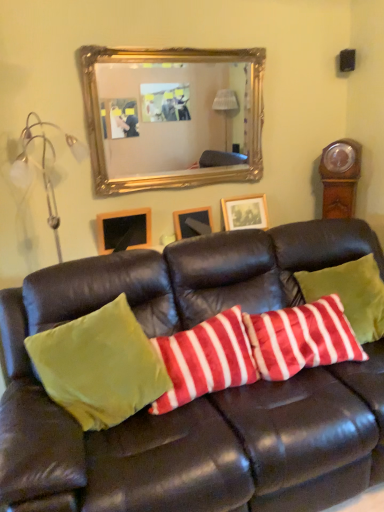
This screenshot has height=512, width=384. Identify the location of green velvet pillow at center, marked as the third pillow in a right-to-left arrangement. (99, 366).

This screenshot has width=384, height=512. Find the location of `velvet green couch at center`. velvet green couch at center is located at coordinates (197, 399).

This screenshot has height=512, width=384. I want to click on matte white picture frame at center, acting as the 3th picture frame starting from the left, so click(x=245, y=212).

Could you tell me if metallic silver lamp at left is turned towards velvet green couch at center?

No.

From the image's perspective, is metallic silver lamp at left positioned above or below velvet green couch at center?

From the image's perspective, metallic silver lamp at left appears above velvet green couch at center.

Is point (24, 168) behind point (237, 296)?

Yes, it is behind point (237, 296).

Considering the relative positions of metallic silver lamp at left and velvet green couch at center in the image provided, is metallic silver lamp at left in front of velvet green couch at center?

No.

Is metallic silver lamp at left next to velvety red and white striped pillow at center, positioned as the 2th pillow in left-to-right order?

No, metallic silver lamp at left is not beside velvety red and white striped pillow at center, positioned as the 2th pillow in left-to-right order.

From a real-world perspective, relative to velvety red and white striped pillow at center, positioned as the 2th pillow in left-to-right order, is metallic silver lamp at left vertically above or below?

In terms of real-world spatial position, metallic silver lamp at left is above velvety red and white striped pillow at center, positioned as the 2th pillow in left-to-right order.

This screenshot has width=384, height=512. I want to click on the 3rd pillow positioned below the metallic silver lamp at left (from a real-world perspective), so click(205, 360).

Is metallic silver lamp at left aimed at velvety red and white striped pillow at center, positioned as the 2th pillow in left-to-right order?

No, metallic silver lamp at left does not turn towards velvety red and white striped pillow at center, positioned as the 2th pillow in left-to-right order.

Considering their positions, is velvet green couch at center located in front of or behind metallic silver lamp at left?

Visually, velvet green couch at center is located in front of metallic silver lamp at left.

Considering the relative sizes of velvet green couch at center and metallic silver lamp at left in the image provided, is velvet green couch at center smaller than metallic silver lamp at left?

Actually, velvet green couch at center might be larger than metallic silver lamp at left.

Is velvet green couch at center positioned with its back to metallic silver lamp at left?

No, velvet green couch at center is not facing away from metallic silver lamp at left.

Would you say velvet green couch at center is a long distance from metallic silver lamp at left?

Yes, velvet green couch at center is far from metallic silver lamp at left.

Are velvet green couch at center and wooden picture frame at upper left, the 1th picture frame from the left, far apart?

velvet green couch at center is actually quite close to wooden picture frame at upper left, the 1th picture frame from the left.

Locate an element on the screen. The width and height of the screenshot is (384, 512). the 1st picture frame above when counting from the velvet green couch at center (from the image's perspective) is located at coordinates (124, 229).

Does velvet green couch at center have a lesser height compared to wooden picture frame at upper left, the 1th picture frame from the left?

Incorrect, the height of velvet green couch at center does not fall short of that of wooden picture frame at upper left, the 1th picture frame from the left.

From a real-world perspective, is velvet green couch at center beneath wooden picture frame at upper left, which is the third picture frame in right-to-left order?

Yes, from a real-world perspective, velvet green couch at center is below wooden picture frame at upper left, which is the third picture frame in right-to-left order.

Looking at this image, considering the relative positions of wooden grandfather clock at right and velvet green couch at center in the image provided, is wooden grandfather clock at right to the right of velvet green couch at center from the viewer's perspective?

Correct, you'll find wooden grandfather clock at right to the right of velvet green couch at center.

In the scene shown: In terms of width, does wooden grandfather clock at right look wider or thinner when compared to velvet green couch at center?

In the image, wooden grandfather clock at right appears to be more narrow than velvet green couch at center.

Is there a large distance between wooden grandfather clock at right and velvet green couch at center?

Yes.

Can you tell me how much wooden grandfather clock at right and velvet green couch at center differ in facing direction?

They differ by 52.1 degrees in their facing directions.

Looking at this image, is green velvet pillow at center, marked as the third pillow in a right-to-left arrangement, next to velvety red and white striped pillow at center, positioned as the second pillow in right-to-left order?

green velvet pillow at center, marked as the third pillow in a right-to-left arrangement, and velvety red and white striped pillow at center, positioned as the second pillow in right-to-left order, are not in contact.

Where is `pillow below the velvety red and white striped pillow at center, positioned as the 2th pillow in left-to-right order (from the image's perspective)`? The height and width of the screenshot is (512, 384). pillow below the velvety red and white striped pillow at center, positioned as the 2th pillow in left-to-right order (from the image's perspective) is located at coordinates tap(99, 366).

Looking at the image, does green velvet pillow at center, which ranks as the first pillow in left-to-right order, seem bigger or smaller compared to velvety red and white striped pillow at center, positioned as the second pillow in right-to-left order?

Considering their sizes, green velvet pillow at center, which ranks as the first pillow in left-to-right order, takes up more space than velvety red and white striped pillow at center, positioned as the second pillow in right-to-left order.

Does green velvet pillow at center, marked as the third pillow in a right-to-left arrangement, contain velvety red and white striped pillow at center, positioned as the second pillow in right-to-left order?

Yes, velvety red and white striped pillow at center, positioned as the second pillow in right-to-left order, is a part of green velvet pillow at center, marked as the third pillow in a right-to-left arrangement.

Is velvet green couch at center situated inside gold/gilded mirror at upper center or outside?

The correct answer is: outside.

Between velvet green couch at center and gold/gilded mirror at upper center, which one has smaller size?

gold/gilded mirror at upper center.

Locate an element on the screen. mirror that appears above the velvet green couch at center (from a real-world perspective) is located at coordinates (171, 114).

Is velvet green couch at center far from gold/gilded mirror at upper center?

That's right, there is a large distance between velvet green couch at center and gold/gilded mirror at upper center.

Locate an element on the screen. The width and height of the screenshot is (384, 512). lamp on the left of velvet green couch at center is located at coordinates (43, 167).

There is a metallic silver lamp at left. What are the coordinates of `the 3rd pillow below it (from a real-world perspective)` in the screenshot? It's located at (205, 360).

When comparing their distances from velvety red and white striped pillow at center, the third pillow when ordered from left to right, does wooden picture frame at upper left, the 1th picture frame from the left, or green velvet pillow at center, which ranks as the first pillow in left-to-right order, seem further?

wooden picture frame at upper left, the 1th picture frame from the left, is further to velvety red and white striped pillow at center, the third pillow when ordered from left to right.

When comparing their distances from velvety red and white striped pillow at center, positioned as the second pillow in right-to-left order, does velvety red and white striped pillow at center, which ranks as the first pillow in right-to-left order, or wooden picture frame at center, which is the second picture frame from left to right, seem closer?

Among the two, velvety red and white striped pillow at center, which ranks as the first pillow in right-to-left order, is located nearer to velvety red and white striped pillow at center, positioned as the second pillow in right-to-left order.

From the image, which object appears to be nearer to wooden picture frame at center, the 2th picture frame when ordered from right to left, green velvet pillow at center, marked as the third pillow in a right-to-left arrangement, or matte white picture frame at center, acting as the 3th picture frame starting from the left?

matte white picture frame at center, acting as the 3th picture frame starting from the left, lies closer to wooden picture frame at center, the 2th picture frame when ordered from right to left, than the other object.

Considering their positions, is green velvet pillow at center, which ranks as the first pillow in left-to-right order, positioned further to gold/gilded mirror at upper center than wooden picture frame at upper left, the 1th picture frame from the left?

green velvet pillow at center, which ranks as the first pillow in left-to-right order, is further to gold/gilded mirror at upper center.

Considering their positions, is green velvet pillow at center, marked as the third pillow in a right-to-left arrangement, positioned further to wooden picture frame at upper left, the 1th picture frame from the left, than metallic silver lamp at left?

Among the two, green velvet pillow at center, marked as the third pillow in a right-to-left arrangement, is located further to wooden picture frame at upper left, the 1th picture frame from the left.

Considering their positions, is metallic silver lamp at left positioned further to wooden picture frame at center, which is the second picture frame from left to right, than gold/gilded mirror at upper center?

The object further to wooden picture frame at center, which is the second picture frame from left to right, is gold/gilded mirror at upper center.

Looking at the image, which one is located further to wooden picture frame at upper left, which is the third picture frame in right-to-left order, wooden picture frame at center, which is the second picture frame from left to right, or wooden grandfather clock at right?

Based on the image, wooden grandfather clock at right appears to be further to wooden picture frame at upper left, which is the third picture frame in right-to-left order.

Considering their positions, is metallic silver lamp at left positioned closer to wooden picture frame at upper left, the 1th picture frame from the left, than green velvet pillow at center, which ranks as the first pillow in left-to-right order?

metallic silver lamp at left lies closer to wooden picture frame at upper left, the 1th picture frame from the left, than the other object.

Identify the location of mirror between green velvet pillow at center, which ranks as the first pillow in left-to-right order, and wooden grandfather clock at right, in the horizontal direction. (171, 114).

Find the location of a particular element. mirror between metallic silver lamp at left and wooden grandfather clock at right is located at coordinates (171, 114).

The image size is (384, 512). Find the location of `mirror between velvet green couch at center and wooden picture frame at upper left, the 1th picture frame from the left, from front to back`. mirror between velvet green couch at center and wooden picture frame at upper left, the 1th picture frame from the left, from front to back is located at coordinates (171, 114).

The image size is (384, 512). I want to click on studio couch located between metallic silver lamp at left and wooden grandfather clock at right in the left-right direction, so point(197,399).